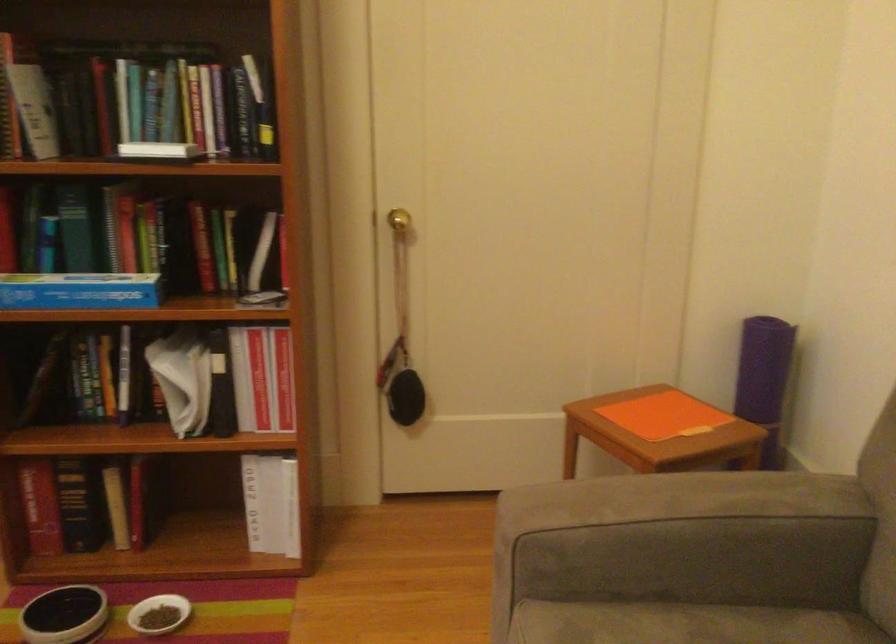
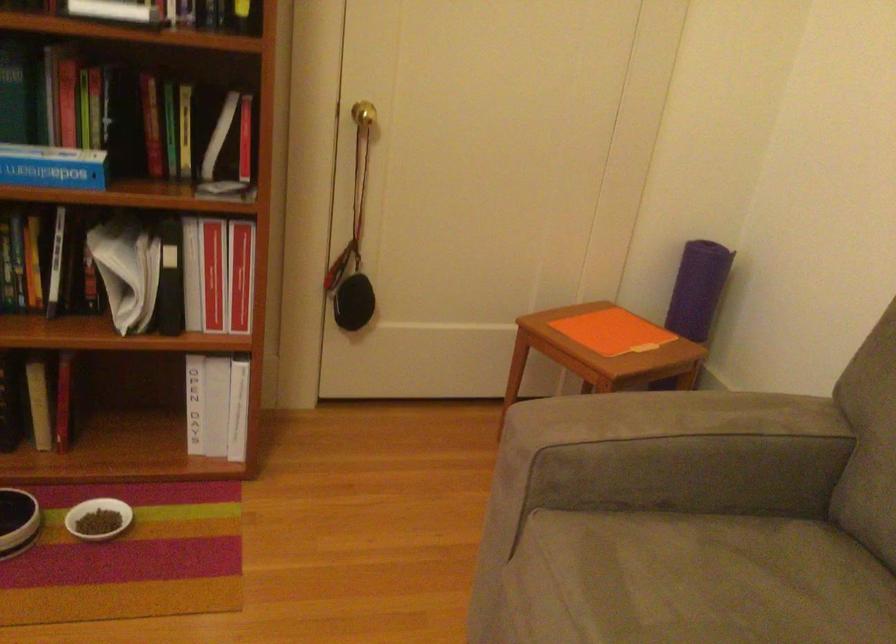
Question: Which direction would the cameraman need to move to produce the second image? Reply with the corresponding letter.

Choices:
 (A) Left
 (B) Right
 (C) Forward
 (D) Backward

Answer: (A)